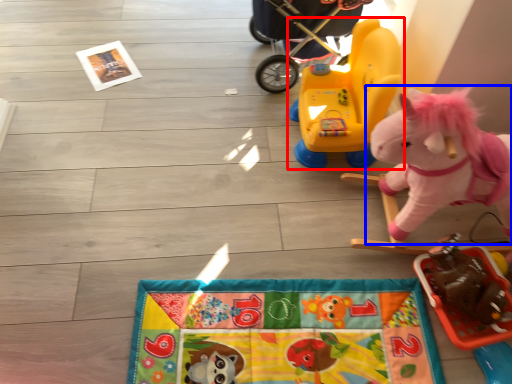
Question: Which object is further to the camera taking this photo, toy (highlighted by a red box) or toy (highlighted by a blue box)?

Choices:
 (A) toy
 (B) toy

Answer: (A)